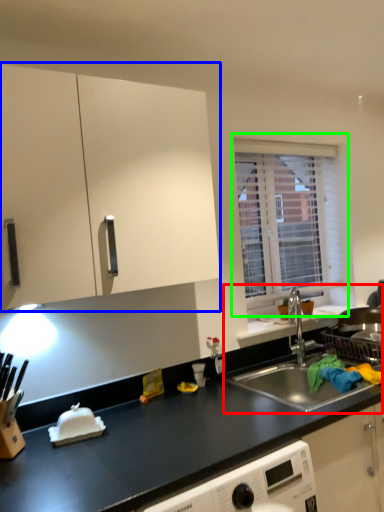
Question: Which is farther away from sink (highlighted by a red box)? cabinetry (highlighted by a blue box) or window (highlighted by a green box)?

Choices:
 (A) cabinetry
 (B) window

Answer: (A)